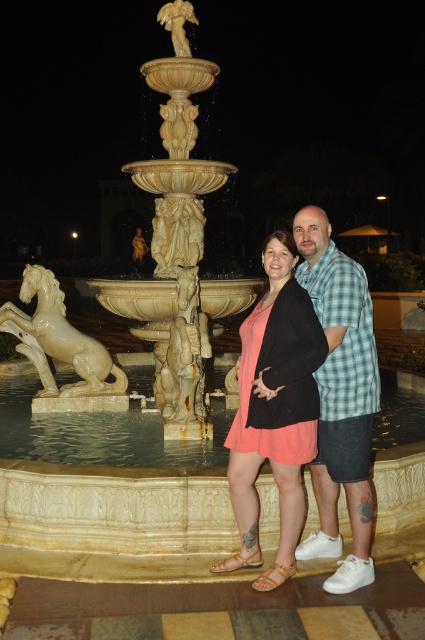
You are standing in front of the fountain and see the point at coordinates [274,410]. What object is located at that point?

The point at coordinates [274,410] corresponds to the matte coral dress at center.

You are a photographer trying to capture the scene with a camera. You notice the matte coral dress at center and the white glossy horse at left. Which object appears narrower in the photo?

The matte coral dress at center appears narrower in the photo since it has a lesser width compared to the white glossy horse at left.

You are a photographer trying to capture the two subjects in the scene. Given that the checkered fabric shirt at center and the white glossy horse at left are both in focus, which one would appear bigger in the photo?

The checkered fabric shirt at center would appear bigger in the photo because it has a larger size compared to the white glossy horse at left.